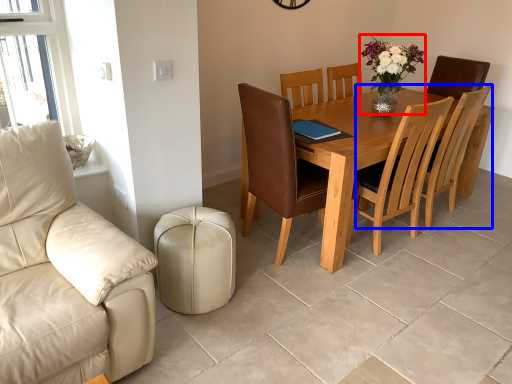
Question: Among these objects, which one is farthest to the camera, floral arrangement (highlighted by a red box) or chair (highlighted by a blue box)?

Choices:
 (A) floral arrangement
 (B) chair

Answer: (B)